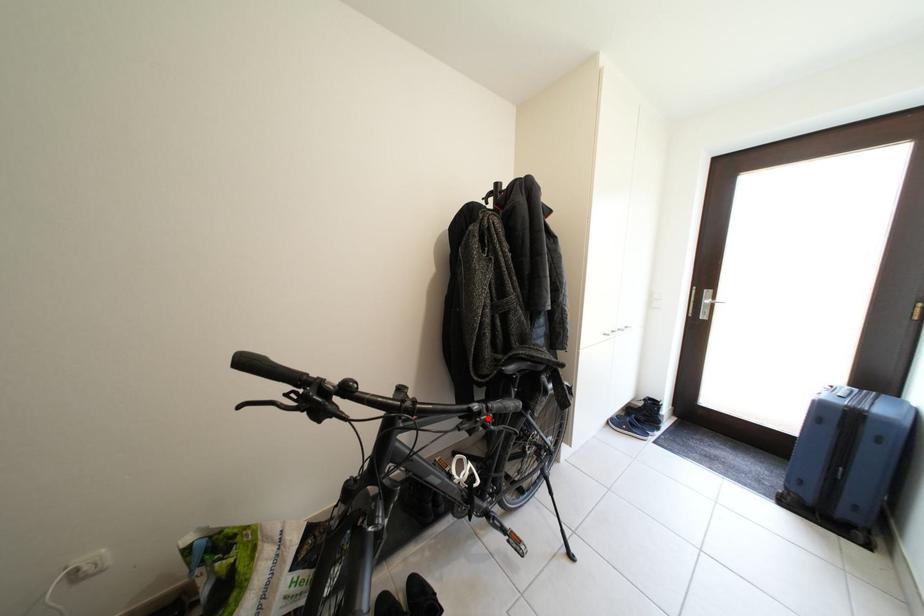
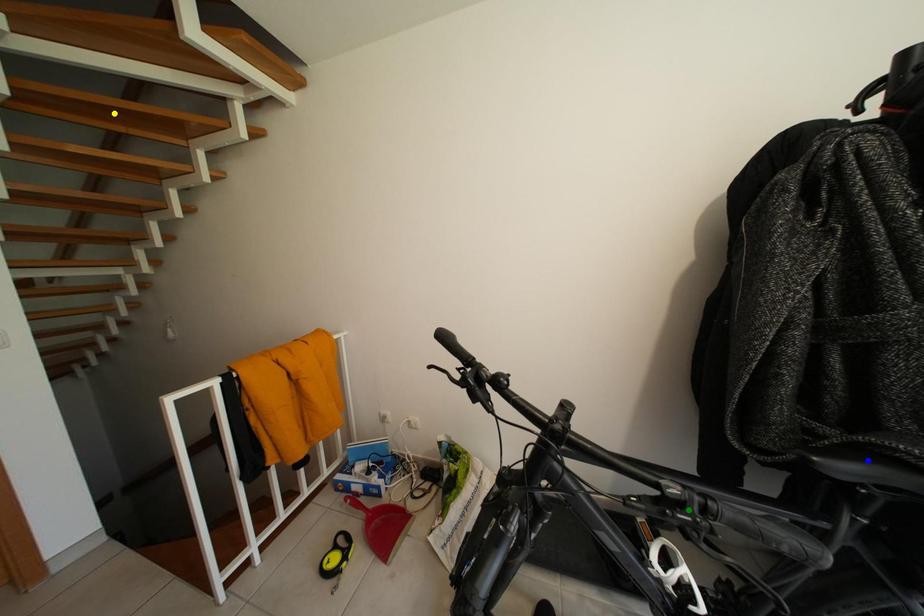
Question: I am providing you with two images of the same scene from different viewpoints. A red point is marked on the first image. You are given multiple points on the second image. Which point in image 2 is actually the same real-world point as the red point in image 1?

Choices:
 (A) blue point
 (B) green point
 (C) yellow point

Answer: (B)